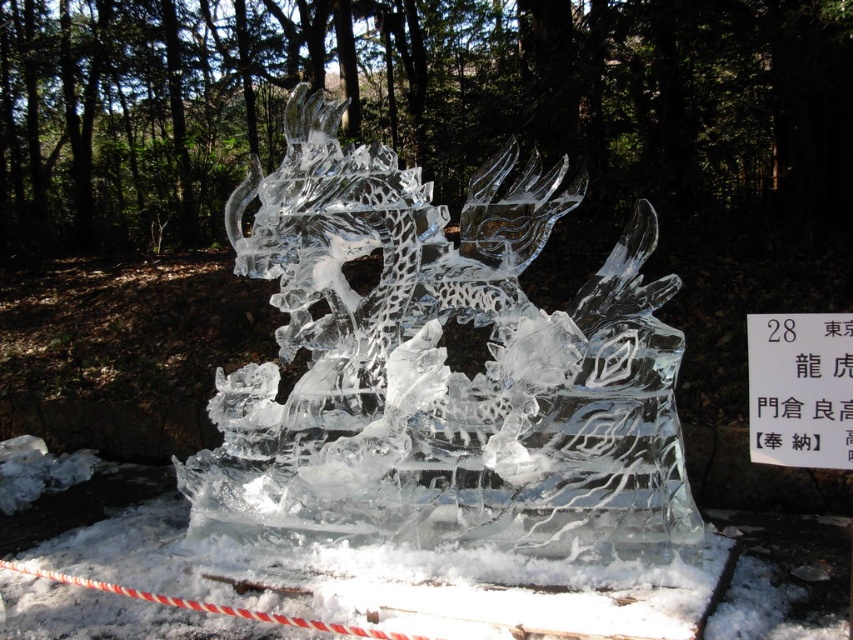
Does transparent ice dragon at center have a lesser height compared to transparent ice sculpture at center?

No.

Is point (675, 536) less distant than point (163, 556)?

Yes.

Identify the location of transparent ice dragon at center. This screenshot has height=640, width=853. pyautogui.click(x=440, y=371).

Can you confirm if transparent ice dragon at center is shorter than white paper at center?

No.

Who is lower down, transparent ice dragon at center or white paper at center?

white paper at center is below.

Who is more forward, [631,404] or [833,428]?

Positioned in front is point [833,428].

You are a GUI agent. You are given a task and a screenshot of the screen. Output one action in this format:
    pyautogui.click(x=<x>, y=<y>)
    Task: Click on the transparent ice dragon at center
    
    Given the screenshot: What is the action you would take?
    pyautogui.click(x=440, y=371)

Is transparent ice sculpture at center closer to the viewer compared to white paper at center?

No, transparent ice sculpture at center is behind white paper at center.

Which is behind, point (479, 605) or point (772, 464)?

Positioned behind is point (479, 605).

You are a GUI agent. You are given a task and a screenshot of the screen. Output one action in this format:
    pyautogui.click(x=<x>, y=<y>)
    Task: Click on the transparent ice sculpture at center
    
    Given the screenshot: What is the action you would take?
    pyautogui.click(x=366, y=589)